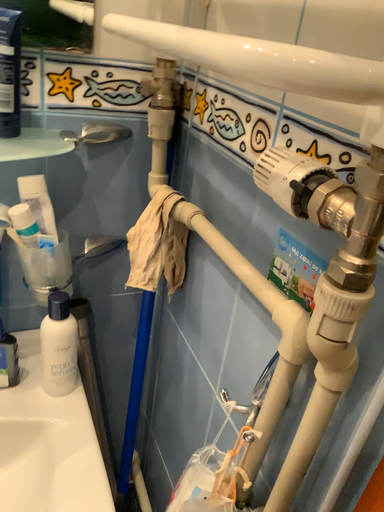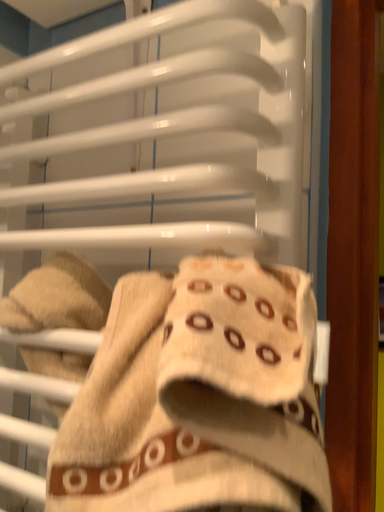
Question: Which way did the camera rotate in the video?

Choices:
 (A) rotated left
 (B) rotated right

Answer: (B)